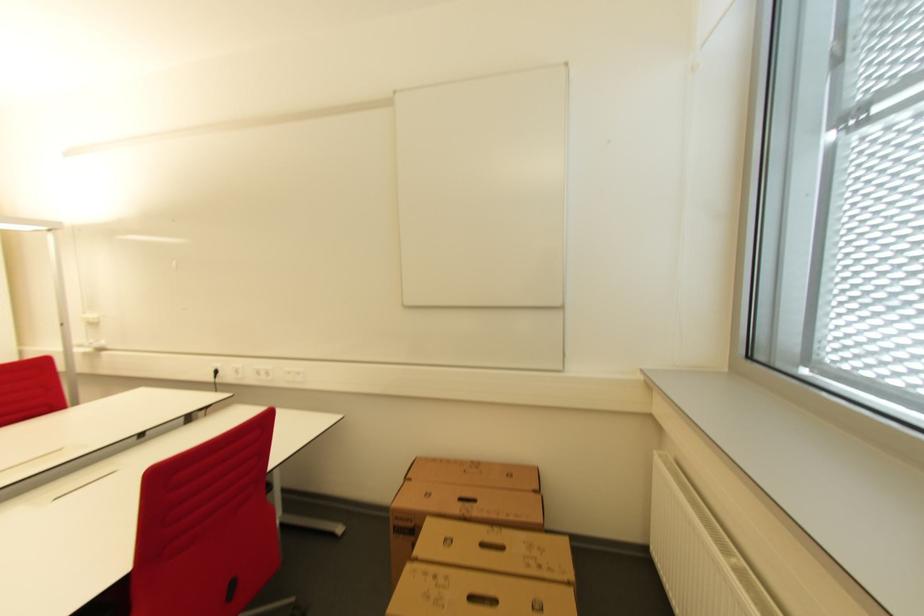
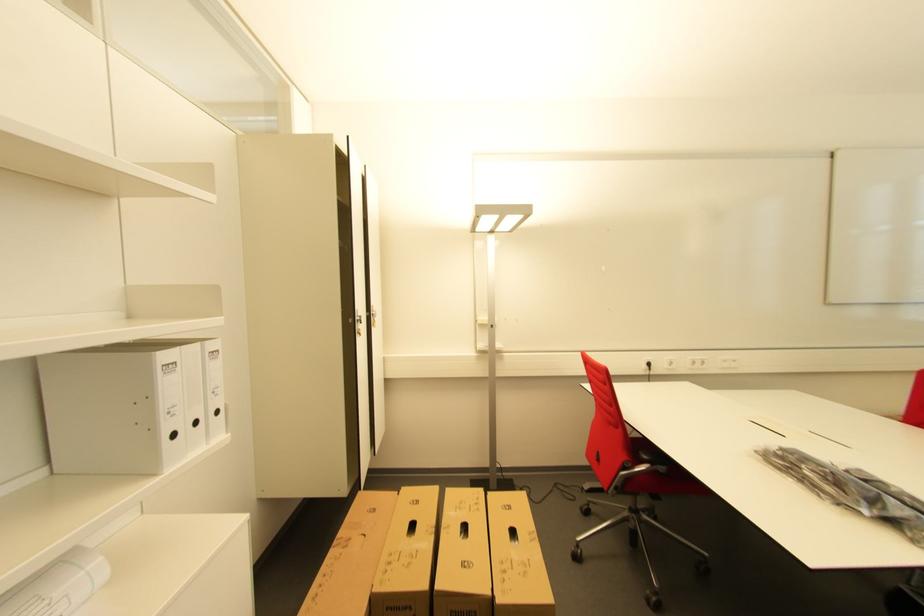
Question: What movement of the cameraman would produce the second image?

Choices:
 (A) Left
 (B) Right
 (C) Forward
 (D) Backward

Answer: (A)